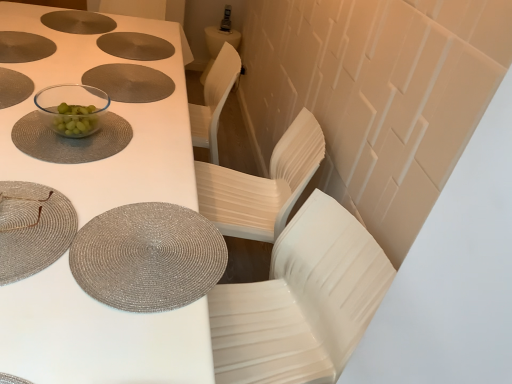
Locate an element on the screen. This screenshot has height=384, width=512. free space between silver woven placemat at lower left, which is the first tableware in front-to-back order, and silver textured placemat at lower left, the 2th tableware positioned from the front is located at coordinates (76, 219).